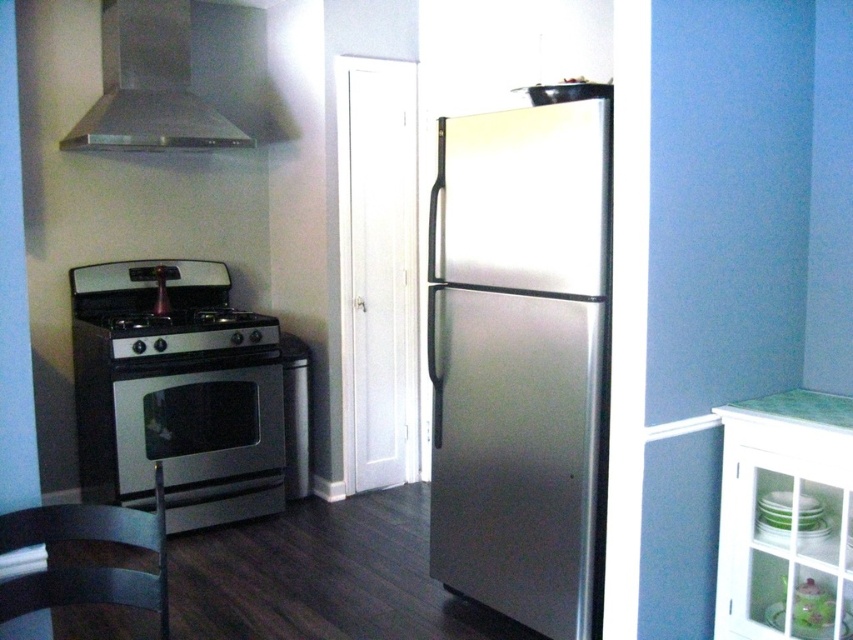
Question: Is satin silver exhaust hood at upper left wider than satin silver stove at left?

Choices:
 (A) yes
 (B) no

Answer: (B)

Question: Which point appears farthest from the camera in this image?

Choices:
 (A) (277, 419)
 (B) (67, 134)
 (C) (225, 326)

Answer: (A)

Question: Which point is closer to the camera?

Choices:
 (A) stainless steel refrigerator at center
 (B) satin silver stove at left

Answer: (A)

Question: Considering the real-world distances, which object is farthest from the satin silver exhaust hood at upper left?

Choices:
 (A) satin silver stove at left
 (B) stainless steel refrigerator at center
 (C) satin silver oven at lower left

Answer: (B)

Question: Can you confirm if satin silver oven at lower left is thinner than satin silver exhaust hood at upper left?

Choices:
 (A) no
 (B) yes

Answer: (B)

Question: From the image, what is the correct spatial relationship of stainless steel refrigerator at center in relation to satin silver stove at left?

Choices:
 (A) above
 (B) below

Answer: (B)